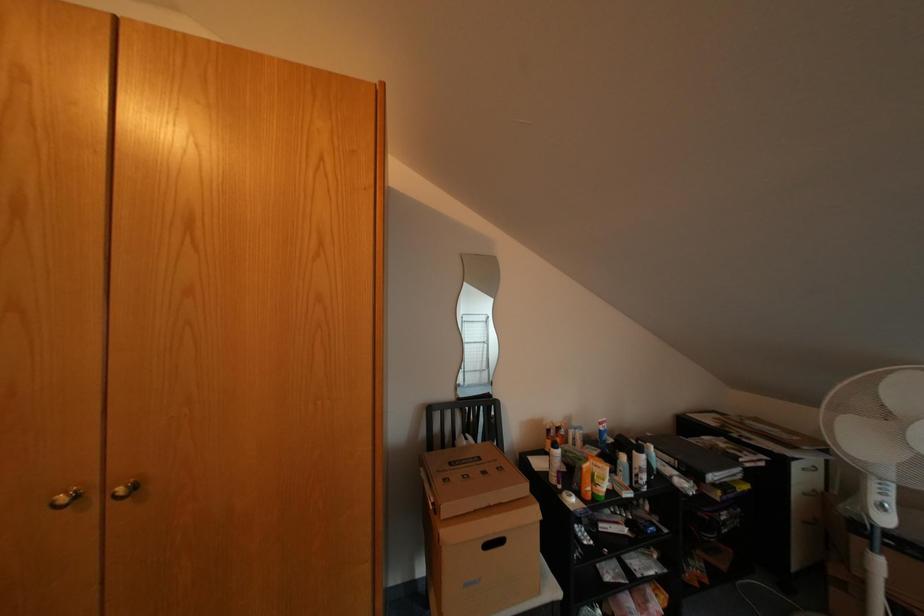
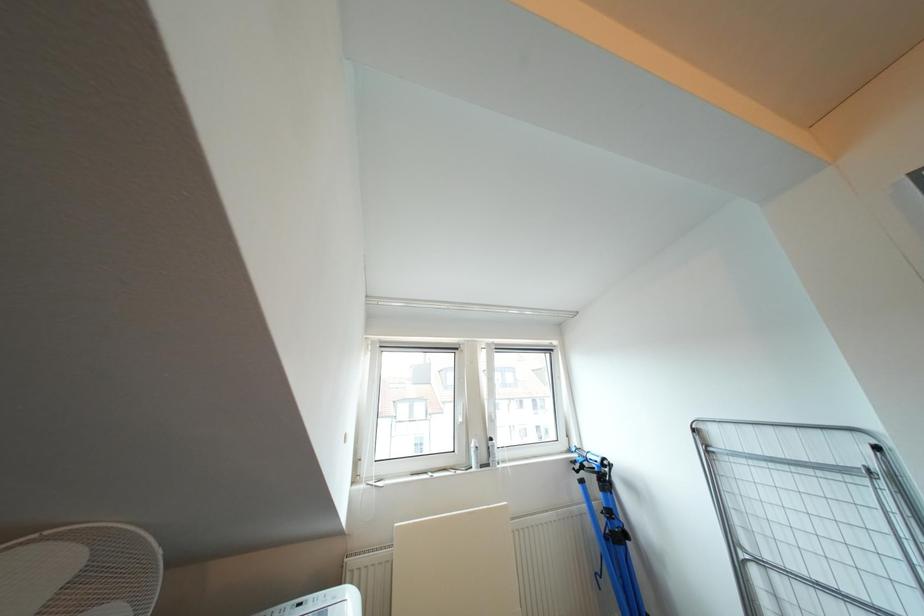
The images are taken continuously from a first-person perspective. In which direction is your viewpoint rotating?

The camera rotated toward right-up.